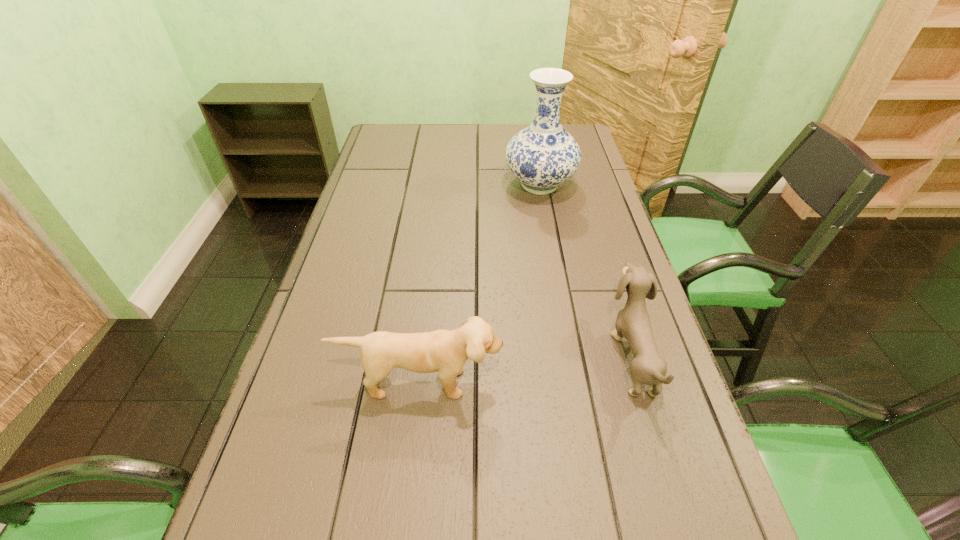
Where is `vase`? vase is located at coordinates (542, 156).

Find the location of a particular element. Image resolution: width=960 pixels, height=540 pixels. the tallest object is located at coordinates (542, 156).

Locate an element on the screen. The width and height of the screenshot is (960, 540). the left puppy is located at coordinates (446, 351).

In order to click on the right puppy in this screenshot , I will do `click(633, 322)`.

Identify the location of vacant space situated 0.120m on the front of the farthest object. This screenshot has width=960, height=540. (548, 231).

What are the coordinates of `free location located 0.220m on the left side of the left puppy` in the screenshot? It's located at (403, 528).

Image resolution: width=960 pixels, height=540 pixels. In order to click on blank space located at the face of the right puppy in this screenshot , I will do `click(570, 356)`.

Find the location of a particular element. vacant space located 0.080m at the face of the right puppy is located at coordinates (575, 356).

Locate an element on the screen. vacant point located at the face of the right puppy is located at coordinates [589, 356].

This screenshot has height=540, width=960. I want to click on object at the left edge, so click(446, 351).